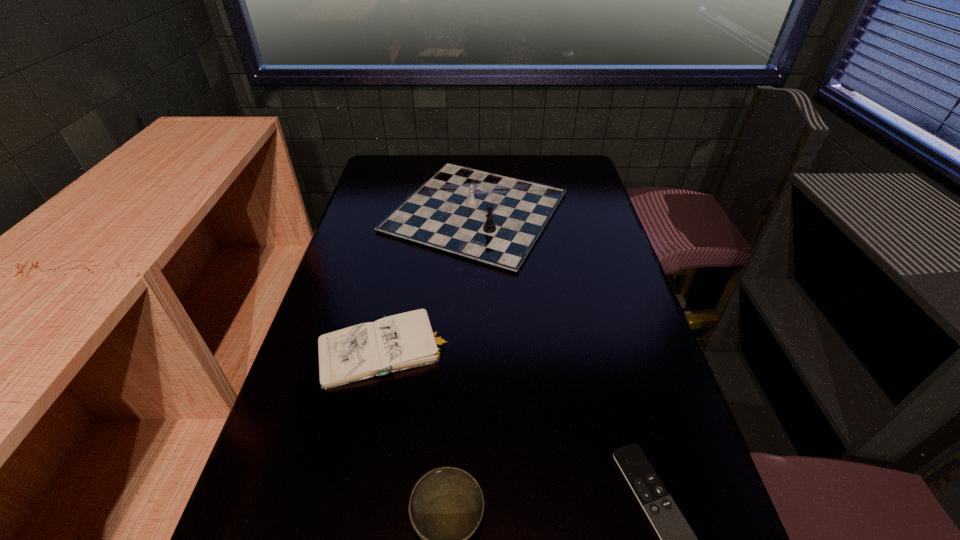
At what (x,y) coordinates should I click in order to perform the action: click on the farthest object. Please return your answer as a coordinate pair (x, y). Image resolution: width=960 pixels, height=540 pixels. Looking at the image, I should click on (495, 219).

Where is `gameboard`? The image size is (960, 540). gameboard is located at coordinates (495, 219).

Identify the location of the second farthest object. (407, 340).

The width and height of the screenshot is (960, 540). What are the coordinates of `the second shortest object` in the screenshot? It's located at (407, 340).

At what (x,y) coordinates should I click in order to perform the action: click on vacant region located on the left of the gameboard. Please return your answer as a coordinate pair (x, y). The image size is (960, 540). Looking at the image, I should click on (363, 212).

This screenshot has height=540, width=960. Find the location of `vacant space situated on the front of the second farthest object`. vacant space situated on the front of the second farthest object is located at coordinates (349, 530).

Image resolution: width=960 pixels, height=540 pixels. Identify the location of object located at the far edge. (495, 219).

I want to click on gameboard located at the left edge, so click(x=495, y=219).

You are a GUI agent. You are given a task and a screenshot of the screen. Output one action in this format:
    pyautogui.click(x=<x>, y=<y>)
    Task: Click on the notebook located in the left edge section of the desktop
    This screenshot has height=540, width=960.
    Given the screenshot: What is the action you would take?
    pyautogui.click(x=407, y=340)

Where is `object positioned at the right edge`? object positioned at the right edge is located at coordinates (495, 219).